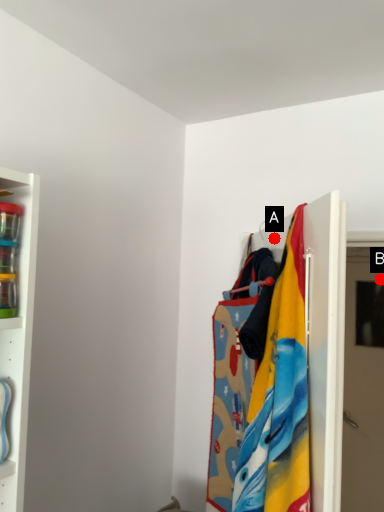
Question: Two points are circled on the image, labeled by A and B beside each circle. Which point is closer to the camera taking this photo?

Choices:
 (A) A is closer
 (B) B is closer

Answer: (A)